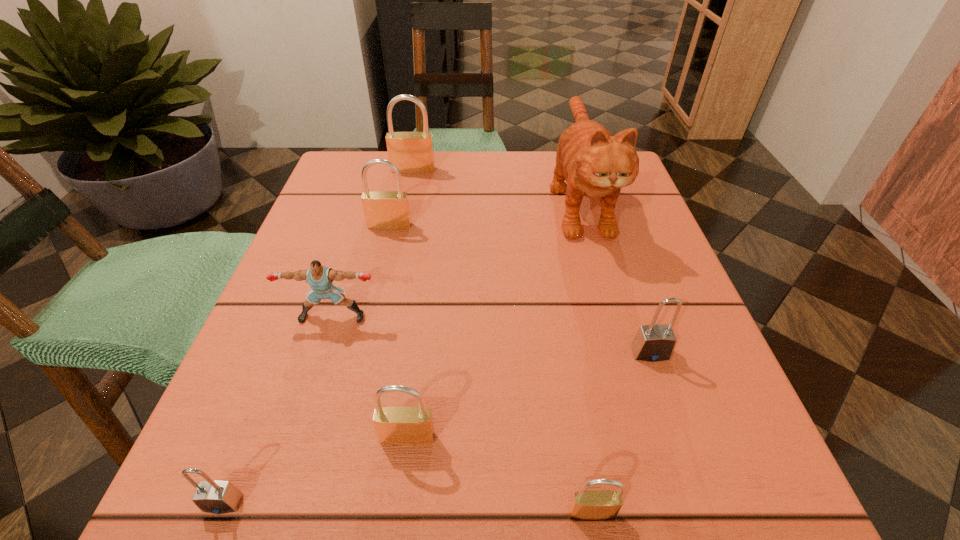
You are a GUI agent. You are given a task and a screenshot of the screen. Output one action in this format:
    pyautogui.click(x=<x>, y=<y>)
    Task: Click on the vacant space situated 0.210m on the shackle of the third farthest padlock
    This screenshot has width=960, height=540.
    Given the screenshot: What is the action you would take?
    705,514

In order to click on cat that is at the far edge in this screenshot , I will do `click(594, 163)`.

This screenshot has height=540, width=960. I want to click on padlock located at the far edge, so click(x=411, y=152).

Locate an element on the screen. The height and width of the screenshot is (540, 960). puncher that is at the left edge is located at coordinates (319, 277).

Where is `cat present at the right edge`? This screenshot has width=960, height=540. cat present at the right edge is located at coordinates (594, 163).

In order to click on padlock present at the right edge in this screenshot , I will do pyautogui.click(x=654, y=342).

Where is `object that is at the far left corner`? The image size is (960, 540). object that is at the far left corner is located at coordinates (411, 152).

Locate an element on the screen. object at the near left corner is located at coordinates (218, 497).

Find the location of `object that is at the far right corner`. object that is at the far right corner is located at coordinates coord(594,163).

Locate an element on the screen. The image size is (960, 540). vacant space at the far edge of the desktop is located at coordinates (491, 157).